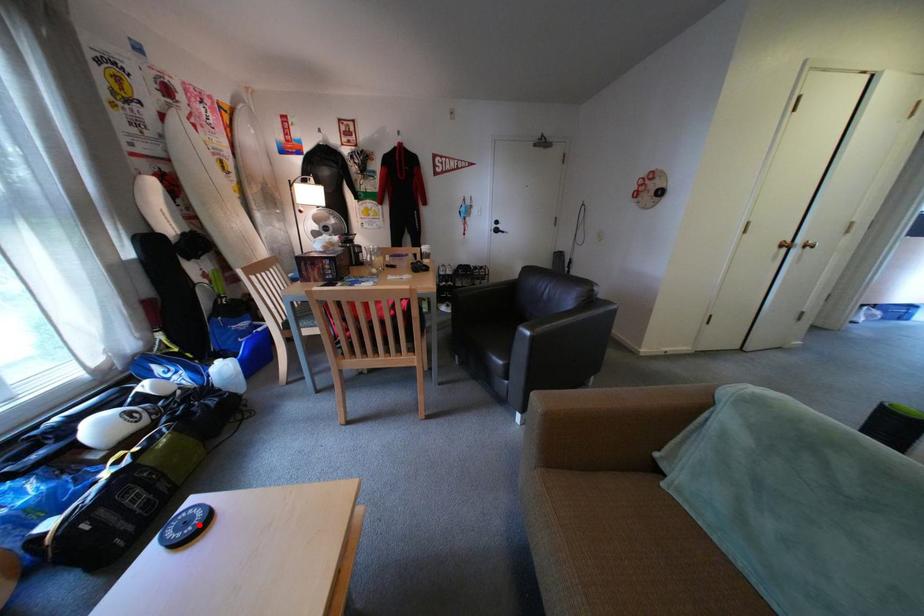
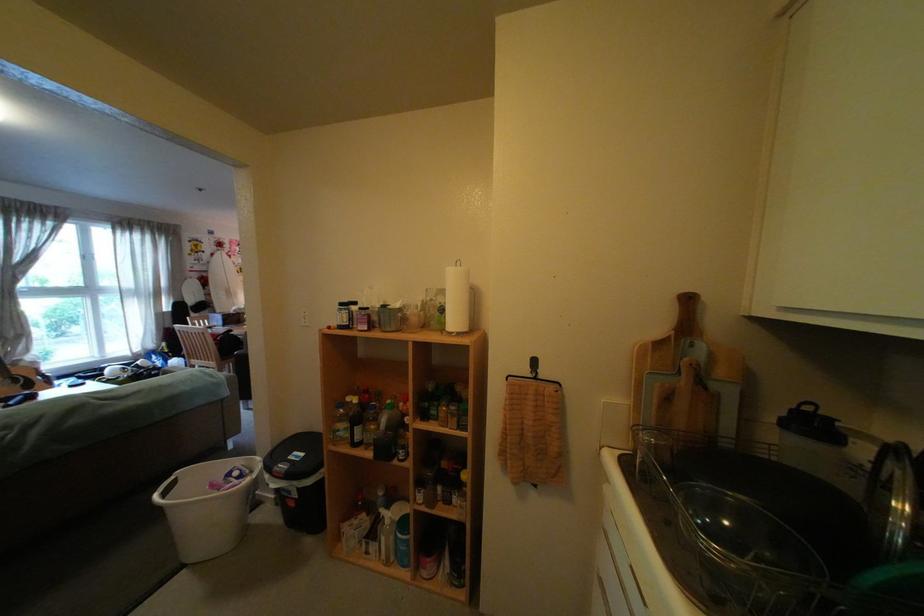
Question: I am providing you with two images of the same scene from different viewpoints. A red point is marked on the first image. Can you still see the location of the red point in image 2?

Choices:
 (A) Yes
 (B) No

Answer: (B)